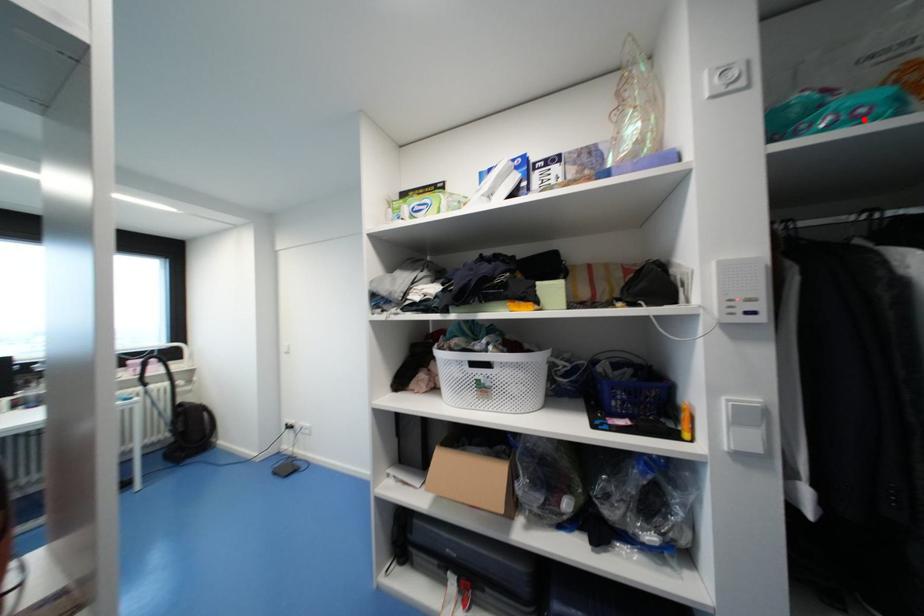
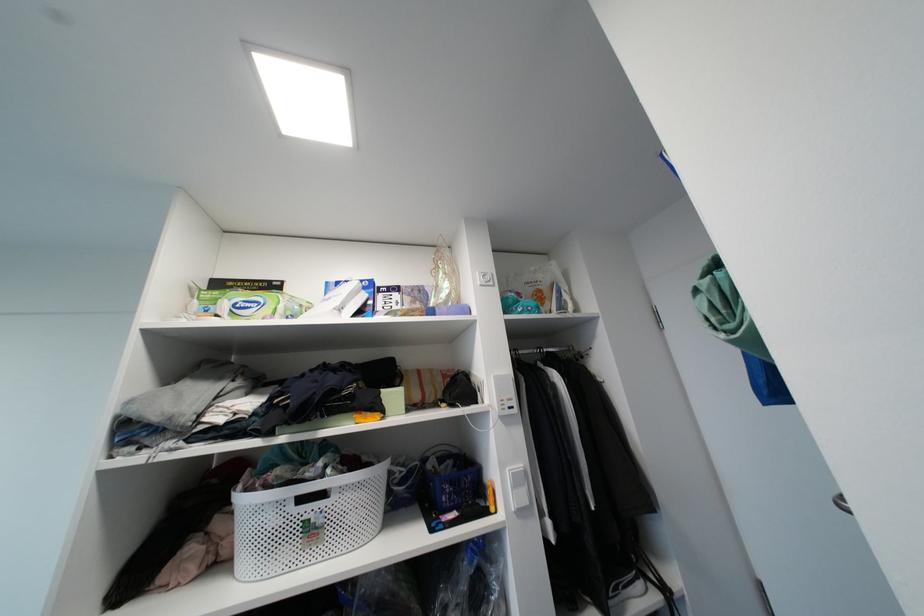
Locate, in the second image, the point that corresponds to the highlighted location in the first image.

(533, 312)